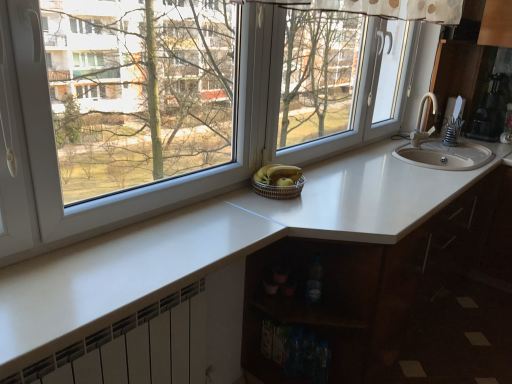
Image resolution: width=512 pixels, height=384 pixels. Identify the location of free spot above woven brown basket at center (from a real-world perspective). (281, 180).